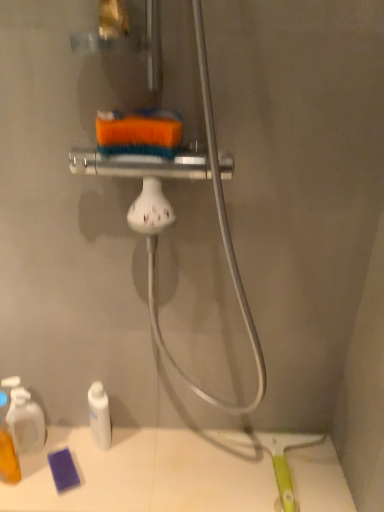
Find the location of a particular element. Image resolution: width=384 pixels, height=512 pixels. free spot above purple sponge at lower left (from a real-world perspective) is located at coordinates (170, 466).